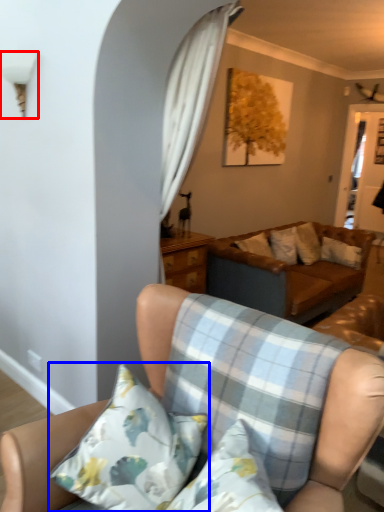
Question: Which object appears closest to the camera in this image, lamp (highlighted by a red box) or pillow (highlighted by a blue box)?

Choices:
 (A) lamp
 (B) pillow

Answer: (B)